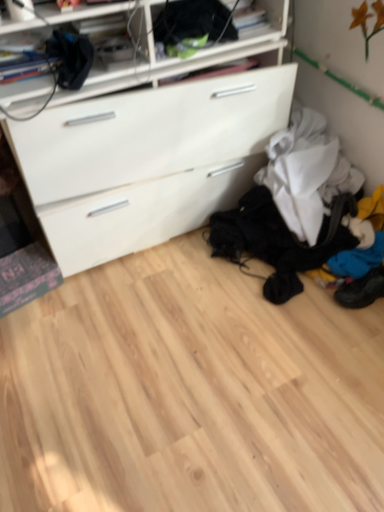
Where is `vacant space positioned to the left of blue fabric shoe at lower right`? The width and height of the screenshot is (384, 512). vacant space positioned to the left of blue fabric shoe at lower right is located at coordinates (317, 303).